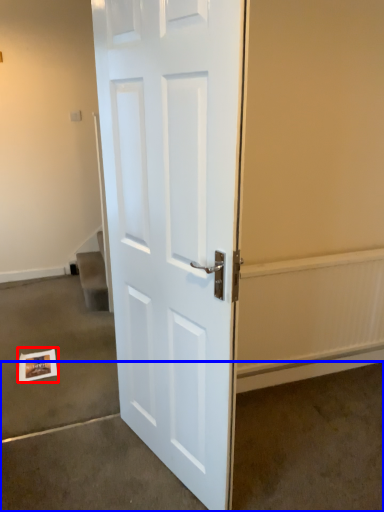
Question: Which of the following is the farthest to the observer, postcard (highlighted by a red box) or concrete (highlighted by a blue box)?

Choices:
 (A) postcard
 (B) concrete

Answer: (A)